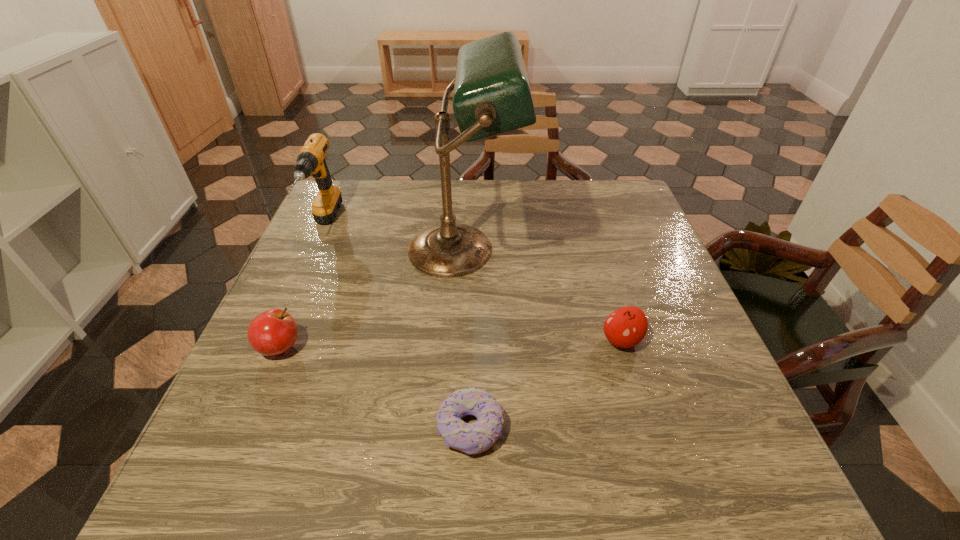
Find the location of a particular element. The image size is (960, 540). table lamp is located at coordinates (492, 95).

At what (x,y) coordinates should I click in order to perform the action: click on the second tallest object. Please return your answer as a coordinate pair (x, y). Looking at the image, I should click on (311, 160).

Where is `the rightmost object`? The width and height of the screenshot is (960, 540). the rightmost object is located at coordinates (626, 327).

Image resolution: width=960 pixels, height=540 pixels. Find the location of `the left apple`. the left apple is located at coordinates (273, 332).

The image size is (960, 540). I want to click on the nearest object, so click(x=474, y=438).

Image resolution: width=960 pixels, height=540 pixels. Identify the location of doughnut. (474, 438).

What are the coordinates of `free space located above the green lampshade of the tallest object` in the screenshot? It's located at (660, 250).

Locate an element on the screen. The image size is (960, 540). vacant space located at the tip of the fourth shortest object is located at coordinates (276, 331).

The width and height of the screenshot is (960, 540). What are the coordinates of `free space located on the left of the rightmost object` in the screenshot? It's located at [x=515, y=340].

I want to click on free space located on the right of the left apple, so click(481, 347).